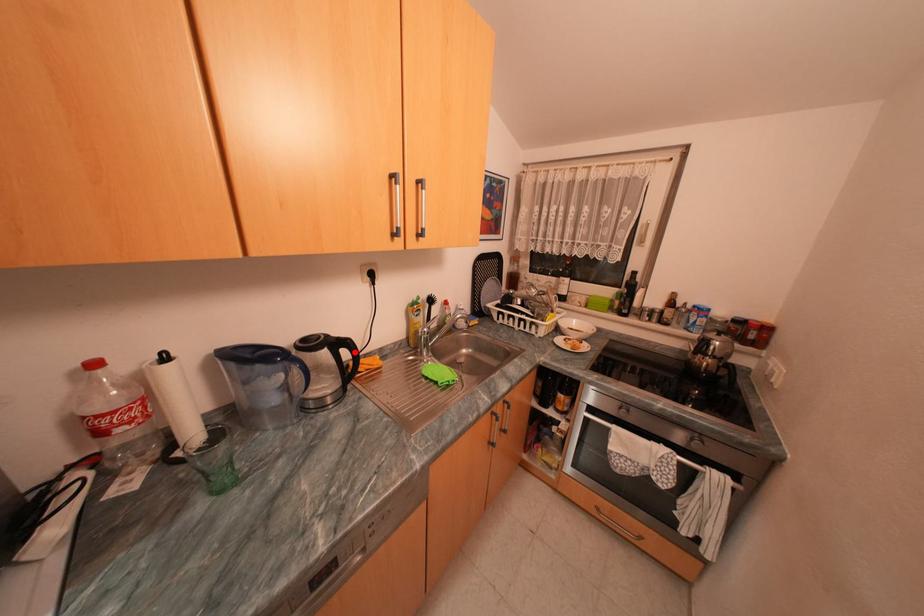
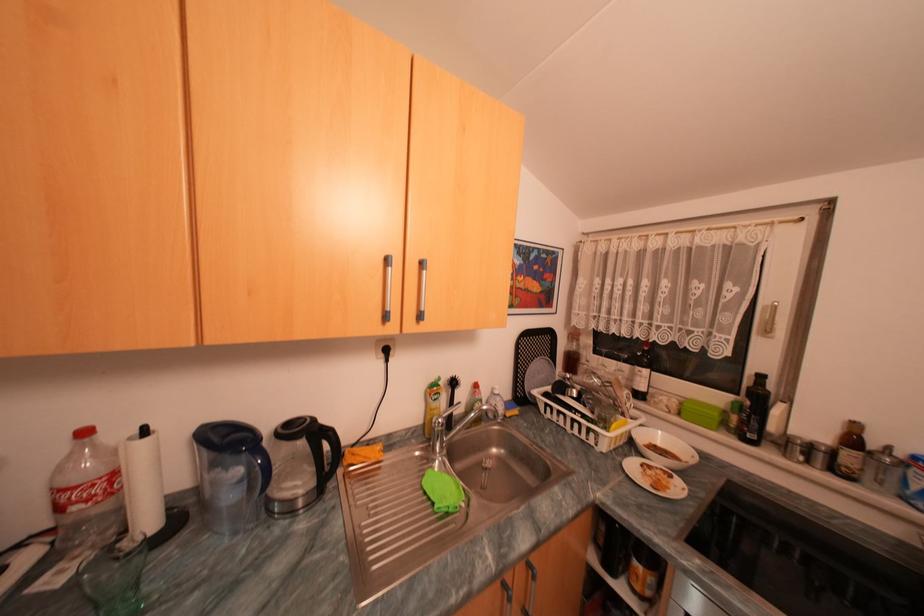
The point at the highlighted location is marked in the first image. Where is the corresponding point in the second image?

(334, 445)